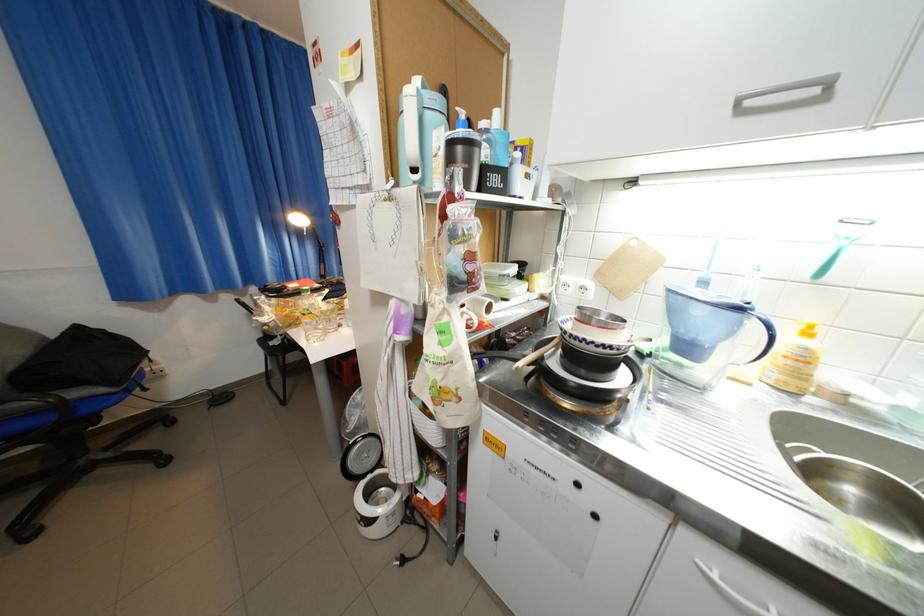
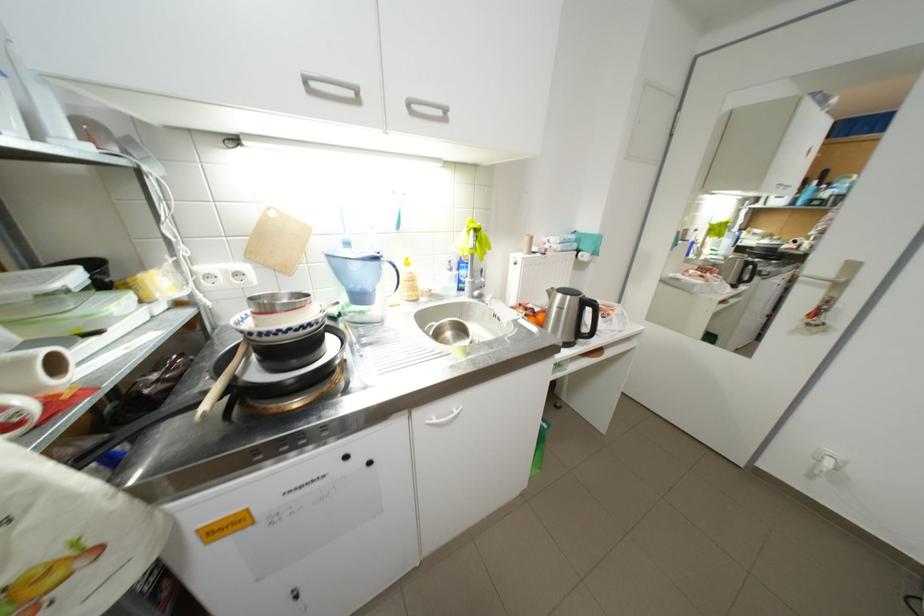
Find the pixel in the second image that matches point (727, 573) in the first image.

(445, 419)